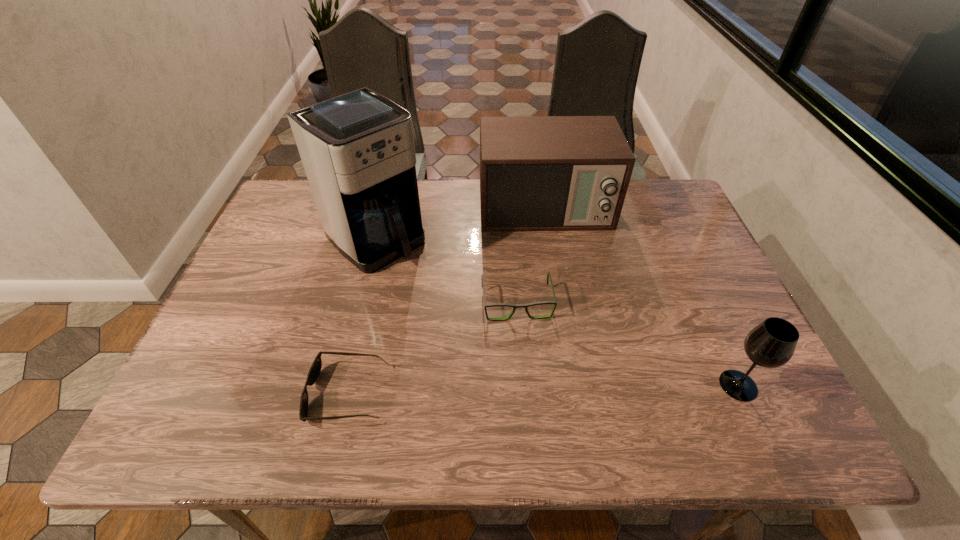
What are the coordinates of `the shortest object` in the screenshot? It's located at (316, 366).

This screenshot has width=960, height=540. What are the coordinates of `the third shortest object` in the screenshot? It's located at (771, 344).

Locate an element on the screen. The height and width of the screenshot is (540, 960). wineglass is located at coordinates (771, 344).

In order to click on spectacles in this screenshot , I will do `click(527, 305)`.

This screenshot has height=540, width=960. What are the coordinates of `the second shortest object` in the screenshot? It's located at (527, 305).

At what (x,y) coordinates should I click in order to perform the action: click on coffee maker. Please return your answer as a coordinate pair (x, y). This screenshot has height=540, width=960. Looking at the image, I should click on (357, 149).

What are the coordinates of `the second tallest object` in the screenshot? It's located at (537, 173).

You are a GUI agent. You are given a task and a screenshot of the screen. Output one action in this format:
    pyautogui.click(x=<x>, y=<y>)
    Task: Click on the free spot located 0.050m on the lenses of the sunglasses
    
    Given the screenshot: What is the action you would take?
    pyautogui.click(x=286, y=394)

I want to click on vacant region located on the lenses of the sunglasses, so click(243, 394).

Identify the location of vacant space situated on the lenses of the sunglasses. This screenshot has width=960, height=540. (185, 394).